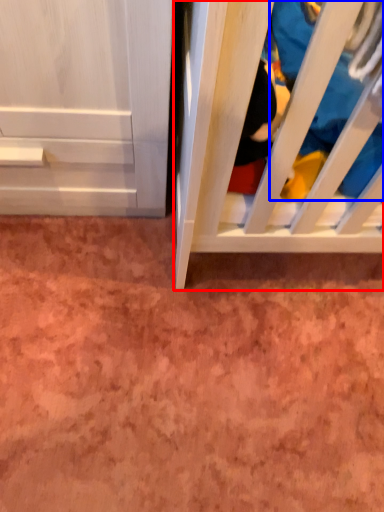
Question: Among these objects, which one is nearest to the camera, furniture (highlighted by a red box) or clothing (highlighted by a blue box)?

Choices:
 (A) furniture
 (B) clothing

Answer: (A)